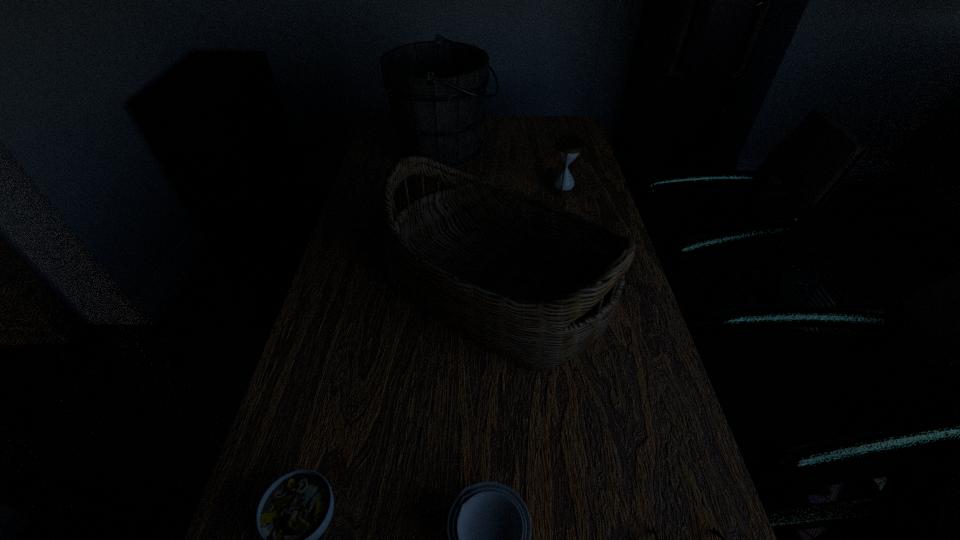
Image resolution: width=960 pixels, height=540 pixels. I want to click on the farthest object, so click(x=436, y=89).

I want to click on bucket, so click(x=436, y=89).

This screenshot has width=960, height=540. I want to click on basket, so click(536, 284).

Identify the location of the fourth nearest object. This screenshot has height=540, width=960. (536, 284).

You are a GUI agent. You are given a task and a screenshot of the screen. Output one action in this format:
    pyautogui.click(x=<x>, y=<y>)
    Task: Click on the second farthest object
    
    Given the screenshot: What is the action you would take?
    pyautogui.click(x=568, y=146)

Image resolution: width=960 pixels, height=540 pixels. Identify the location of the fourth shortest object. (568, 146).

The height and width of the screenshot is (540, 960). Identify the location of blank space located 0.220m on the handle side of the bucket. (558, 150).

Where is `free space located 0.090m on the front of the fourth nearest object`? free space located 0.090m on the front of the fourth nearest object is located at coordinates (501, 418).

The image size is (960, 540). What are the coordinates of `vacant area situated 0.260m on the front of the third tallest object` in the screenshot? It's located at (578, 252).

I want to click on object located in the far edge section of the desktop, so click(x=436, y=89).